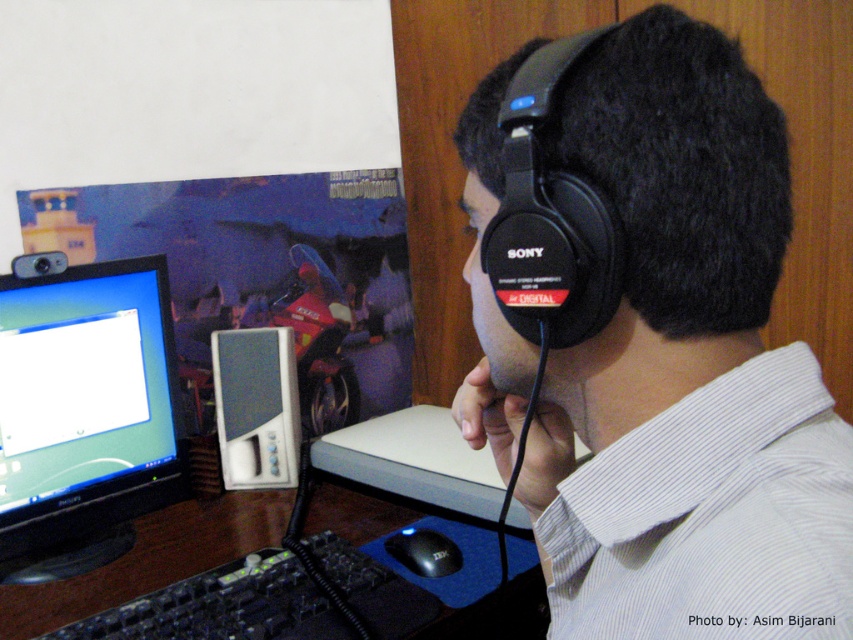
You are a delivery person who needs to place a new mouse that is 3 inches long between the black plastic keyboard at lower left and the white plastic speaker at center. Can you fit it there without moving either object?

The distance between the black plastic keyboard at lower left and the white plastic speaker at center is 6.78 inches. Since the mouse is only 3 inches long, there is enough space to place it between them without moving either object.

You are a delivery person who just arrived at this desk to deliver a new mouse. The mouse is 15 cm long. The space between the black plastic keyboard at lower left and the white plastic speaker at center is 20 cm. Can you place the mouse in that space?

The space between the black plastic keyboard at lower left and the white plastic speaker at center is 20 cm, so the mouse that is 15 cm long can fit in that space.

You are setting up a new workspace and want to place the black plastic keyboard at lower left and the white plastic speaker at center on your desk. If the keyboard takes up more space horizontally than the speaker, which object should you prioritize placing first to ensure they both fit?

The black plastic keyboard at lower left should be placed first since its width is larger than the white plastic speaker at center, ensuring there is enough space for both items.